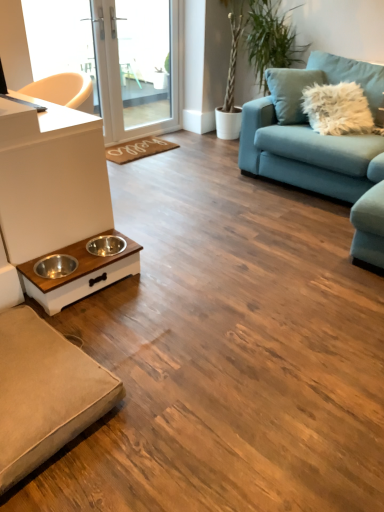
Question: Does brown woven mat at center have a greater width compared to teal fabric couch at upper right, which appears as the 2th studio couch when viewed from the left?

Choices:
 (A) no
 (B) yes

Answer: (A)

Question: Considering the relative sizes of brown woven mat at center and teal fabric couch at upper right, which appears as the 2th studio couch when ordered from the bottom, in the image provided, is brown woven mat at center smaller than teal fabric couch at upper right, which appears as the 2th studio couch when ordered from the bottom,?

Choices:
 (A) yes
 (B) no

Answer: (A)

Question: Does brown woven mat at center have a lesser height compared to teal fabric couch at upper right, the first studio couch from the top?

Choices:
 (A) no
 (B) yes

Answer: (B)

Question: Is brown woven mat at center taller than teal fabric couch at upper right, which appears as the 2th studio couch when viewed from the left?

Choices:
 (A) no
 (B) yes

Answer: (A)

Question: Is brown woven mat at center facing towards teal fabric couch at upper right, which ranks as the 1th studio couch in right-to-left order?

Choices:
 (A) yes
 (B) no

Answer: (B)

Question: Considering the relative sizes of brown woven mat at center and teal fabric couch at upper right, which appears as the 2th studio couch when ordered from the bottom, in the image provided, is brown woven mat at center bigger than teal fabric couch at upper right, which appears as the 2th studio couch when ordered from the bottom,?

Choices:
 (A) no
 (B) yes

Answer: (A)

Question: From the image's perspective, is green leafy plant at upper right above white glossy screen door at upper center?

Choices:
 (A) no
 (B) yes

Answer: (A)

Question: Is green leafy plant at upper right outside white glossy screen door at upper center?

Choices:
 (A) no
 (B) yes

Answer: (B)

Question: Is green leafy plant at upper right shorter than white glossy screen door at upper center?

Choices:
 (A) no
 (B) yes

Answer: (A)

Question: Is green leafy plant at upper right turned away from white glossy screen door at upper center?

Choices:
 (A) no
 (B) yes

Answer: (A)

Question: From a real-world perspective, is green leafy plant at upper right positioned over white glossy screen door at upper center based on gravity?

Choices:
 (A) no
 (B) yes

Answer: (A)

Question: Does green leafy plant at upper right have a greater height compared to white glossy screen door at upper center?

Choices:
 (A) yes
 (B) no

Answer: (A)

Question: Can you confirm if white matte counter top at left is smaller than white wood pet feeder at lower left?

Choices:
 (A) yes
 (B) no

Answer: (B)